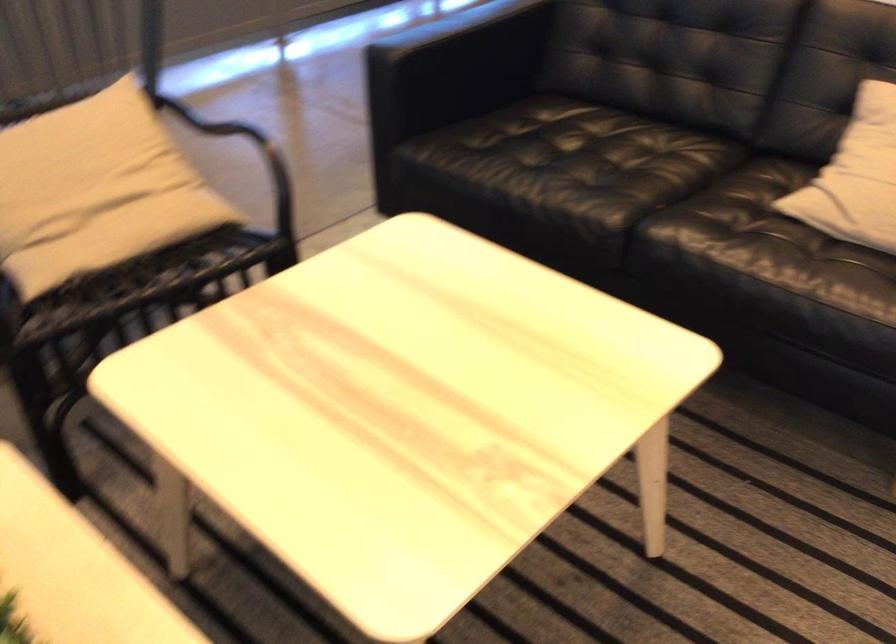
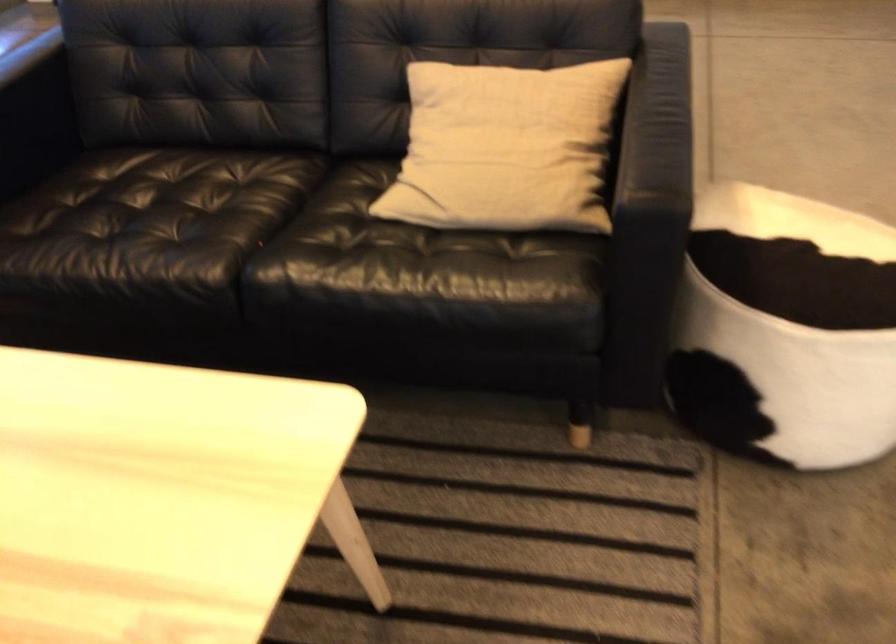
Question: The images are taken continuously from a first-person perspective. In which direction is your viewpoint rotating?

Choices:
 (A) Left
 (B) Right
 (C) Up
 (D) Down

Answer: (B)